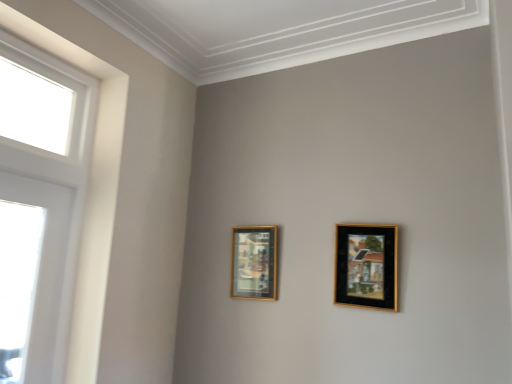
Question: Considering the relative positions of gold-framed picture at center-left, placed as the first picture frame when sorted from left to right, and black matte picture frame at upper right, which is counted as the 2th picture frame, starting from the left, in the image provided, is gold-framed picture at center-left, placed as the first picture frame when sorted from left to right, to the right of black matte picture frame at upper right, which is counted as the 2th picture frame, starting from the left, from the viewer's perspective?

Choices:
 (A) yes
 (B) no

Answer: (B)

Question: Is gold-framed picture at center-left, the second picture frame in the front-to-back sequence, further to camera compared to black matte picture frame at upper right, the 2th picture frame viewed from the back?

Choices:
 (A) no
 (B) yes

Answer: (B)

Question: Is gold-framed picture at center-left, which appears as the second picture frame when viewed from the right, taller than black matte picture frame at upper right, the 2th picture frame viewed from the back?

Choices:
 (A) yes
 (B) no

Answer: (B)

Question: Is gold-framed picture at center-left, which is counted as the first picture frame, starting from the back, far away from black matte picture frame at upper right, the 1th picture frame when ordered from right to left?

Choices:
 (A) no
 (B) yes

Answer: (A)

Question: Is gold-framed picture at center-left, which is counted as the first picture frame, starting from the back, in front of black matte picture frame at upper right, which is the first picture frame from front to back?

Choices:
 (A) yes
 (B) no

Answer: (B)

Question: Considering the positions of white glossy window at left and black matte picture frame at upper right, which is counted as the 2th picture frame, starting from the left, in the image, is white glossy window at left bigger or smaller than black matte picture frame at upper right, which is counted as the 2th picture frame, starting from the left,?

Choices:
 (A) small
 (B) big

Answer: (B)

Question: In the image, is white glossy window at left positioned in front of or behind black matte picture frame at upper right, the 2th picture frame viewed from the back?

Choices:
 (A) front
 (B) behind

Answer: (A)

Question: Is point (77, 284) closer or farther from the camera than point (351, 258)?

Choices:
 (A) closer
 (B) farther

Answer: (B)

Question: Looking at their shapes, would you say white glossy window at left is wider or thinner than black matte picture frame at upper right, which is counted as the 2th picture frame, starting from the left?

Choices:
 (A) wide
 (B) thin

Answer: (A)

Question: From a real-world perspective, relative to white glossy window at left, is black matte picture frame at upper right, the 2th picture frame viewed from the back, vertically above or below?

Choices:
 (A) below
 (B) above

Answer: (A)

Question: From their relative heights in the image, would you say black matte picture frame at upper right, which is counted as the 2th picture frame, starting from the left, is taller or shorter than white glossy window at left?

Choices:
 (A) tall
 (B) short

Answer: (B)

Question: From the image's perspective, is black matte picture frame at upper right, which is counted as the 2th picture frame, starting from the left, above or below white glossy window at left?

Choices:
 (A) above
 (B) below

Answer: (B)

Question: Considering the positions of black matte picture frame at upper right, which is counted as the 2th picture frame, starting from the left, and white glossy window at left in the image, is black matte picture frame at upper right, which is counted as the 2th picture frame, starting from the left, wider or thinner than white glossy window at left?

Choices:
 (A) thin
 (B) wide

Answer: (A)

Question: In terms of size, does gold-framed picture at center-left, the second picture frame in the front-to-back sequence, appear bigger or smaller than black matte picture frame at upper right, the 1th picture frame when ordered from right to left?

Choices:
 (A) big
 (B) small

Answer: (B)

Question: From the image's perspective, relative to black matte picture frame at upper right, which is counted as the 2th picture frame, starting from the left, is gold-framed picture at center-left, which is counted as the first picture frame, starting from the back, above or below?

Choices:
 (A) below
 (B) above

Answer: (A)